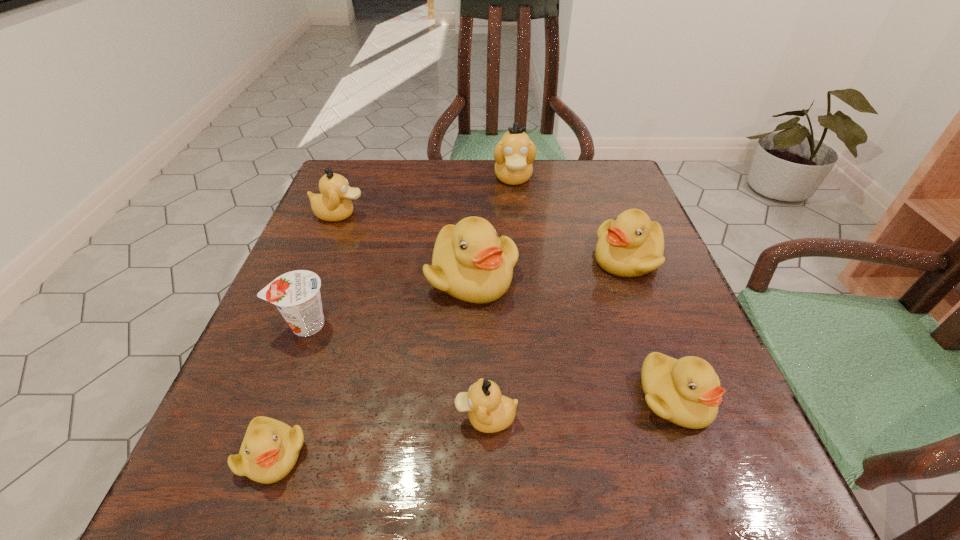
I want to click on the farthest tan duckling, so pyautogui.click(x=514, y=154).

Where is `the farthest duckling`? the farthest duckling is located at coordinates (514, 154).

Identify the location of the second yellow duckling from left to right. (470, 262).

The height and width of the screenshot is (540, 960). I want to click on the seventh nearest object, so click(x=333, y=204).

This screenshot has width=960, height=540. In order to click on the second smallest tan duckling in this screenshot , I will do click(333, 204).

Locate an element on the screen. The width and height of the screenshot is (960, 540). the third smallest yellow duckling is located at coordinates (632, 245).

Where is `the third biggest yellow duckling`? This screenshot has width=960, height=540. the third biggest yellow duckling is located at coordinates (686, 392).

Where is `yogurt`? The height and width of the screenshot is (540, 960). yogurt is located at coordinates (296, 294).

Where is `the nearest tan duckling`? The height and width of the screenshot is (540, 960). the nearest tan duckling is located at coordinates (489, 412).

Identify the location of the shortest object. (270, 449).